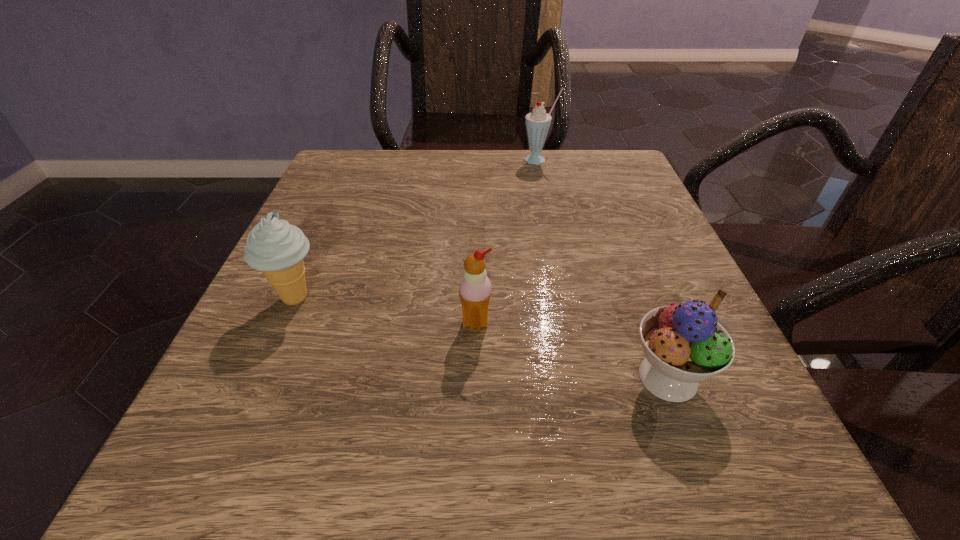
In order to click on the third object from left to right in this screenshot , I will do `click(537, 122)`.

Find the location of `the farthest object`. the farthest object is located at coordinates (537, 122).

Identify the location of the leftmost object. (275, 247).

Locate an element on the screen. Image resolution: width=960 pixels, height=540 pixels. the second icecream from left to right is located at coordinates (475, 287).

This screenshot has width=960, height=540. Find the location of `the nearest object`. the nearest object is located at coordinates (684, 344).

Locate an element on the screen. The width and height of the screenshot is (960, 540). the rightmost icecream is located at coordinates (684, 344).

Find the location of a particular element. The width and height of the screenshot is (960, 540). vacant space situated on the straw side of the milkshake is located at coordinates (564, 274).

This screenshot has height=540, width=960. I want to click on vacant space situated 0.110m on the right of the leftmost object, so click(x=393, y=298).

Identify the location of vacant space located at the front with a straw on the second icecream from left to right. (474, 408).

You are a GUI agent. You are given a task and a screenshot of the screen. Output one action in this format:
    pyautogui.click(x=<x>, y=<y>)
    Task: Click on the free spot located 0.260m on the left of the rightmost object
    This screenshot has height=540, width=960.
    Given the screenshot: What is the action you would take?
    pyautogui.click(x=433, y=377)